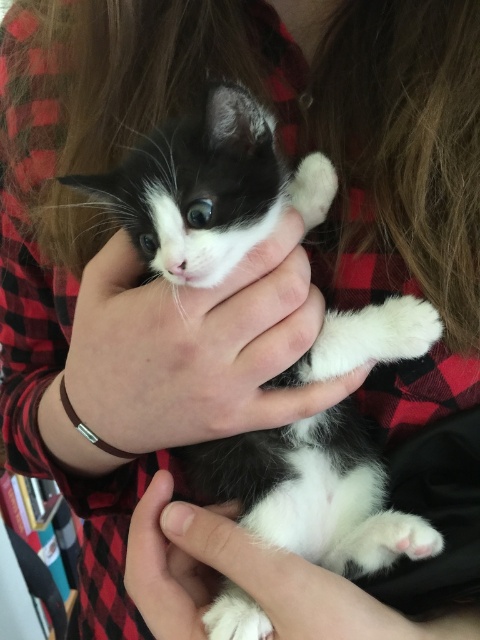
Question: Does soft fur kitten at center appear over white fur at center?

Choices:
 (A) yes
 (B) no

Answer: (A)

Question: Does soft fur kitten at center have a greater width compared to white fur at center?

Choices:
 (A) no
 (B) yes

Answer: (B)

Question: Which point is farther to the camera?

Choices:
 (A) (240, 552)
 (B) (153, 202)

Answer: (B)

Question: Is soft fur kitten at center bigger than white fur at center?

Choices:
 (A) yes
 (B) no

Answer: (A)